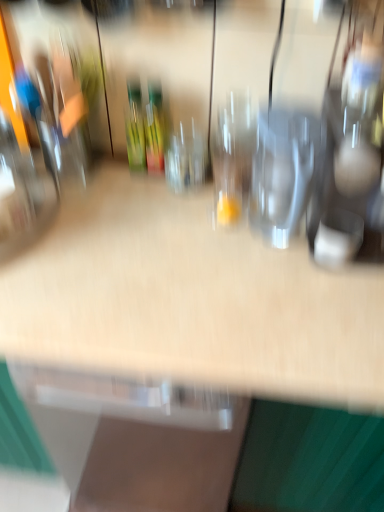
At what (x,y) coordinates should I click in order to perform the action: click on free location in front of green glass bottle at center. Please return your answer as a coordinate pair (x, y). Image resolution: width=384 pixels, height=512 pixels. Looking at the image, I should click on (130, 203).